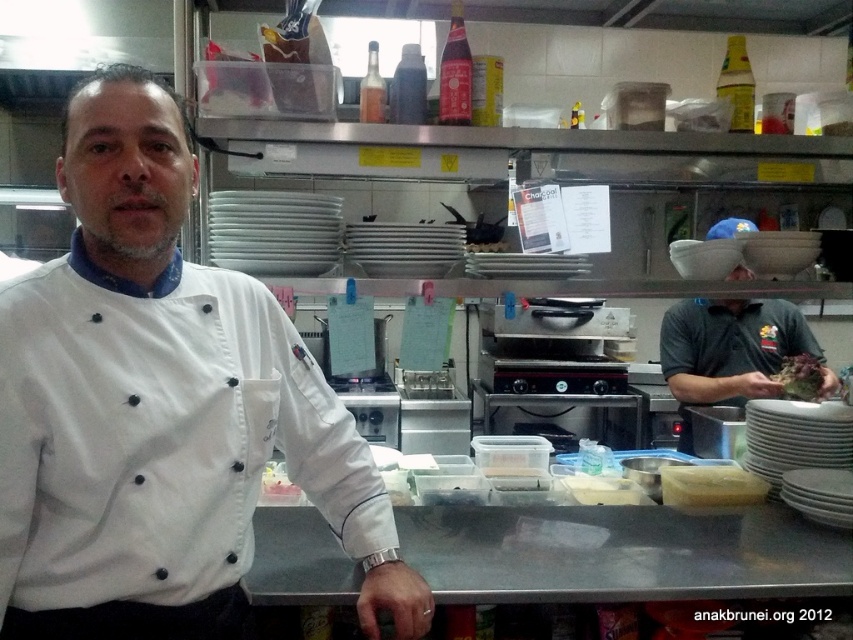
Question: Which point is closer to the camera?

Choices:
 (A) brown matte food at center
 (B) yellow matte cheese at center
 (C) white matte chef coat at center
 (D) green leafy vegetable at center

Answer: (C)

Question: Which point is closer to the camera?

Choices:
 (A) yellow matte cheese at center
 (B) brown matte food at center
 (C) green leafy vegetable at center
 (D) white matte chef coat at center

Answer: (D)

Question: Does green leafy vegetable at center have a larger size compared to brown matte food at center?

Choices:
 (A) yes
 (B) no

Answer: (A)

Question: Is yellow matte cheese at center to the left of green leafy vegetable at center from the viewer's perspective?

Choices:
 (A) yes
 (B) no

Answer: (A)

Question: Which point appears farthest from the camera in this image?

Choices:
 (A) (809, 392)
 (B) (0, 550)

Answer: (A)

Question: Is white matte chef coat at center to the right of green leafy vegetable at center from the viewer's perspective?

Choices:
 (A) no
 (B) yes

Answer: (A)